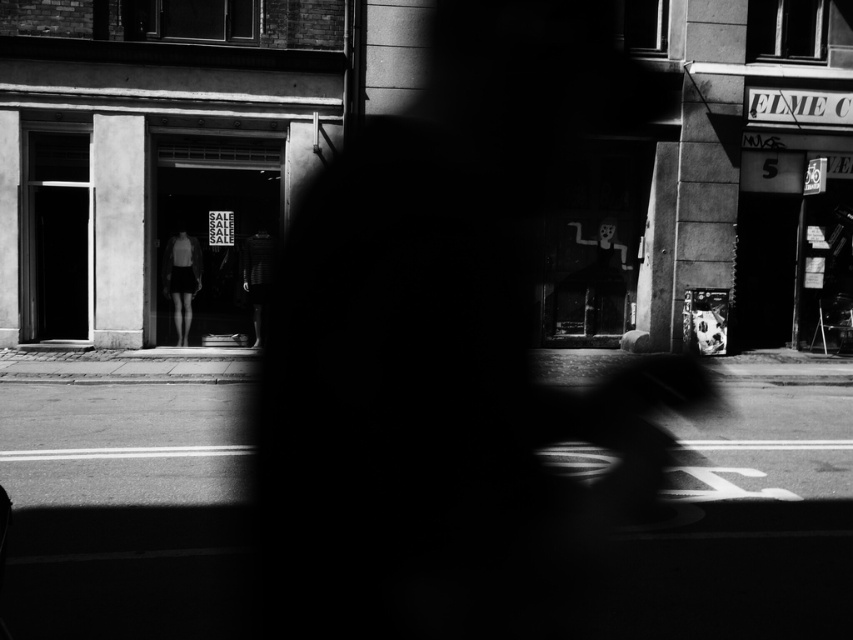
Question: Does smooth black mask at center have a larger size compared to smooth skin figure at center?

Choices:
 (A) no
 (B) yes

Answer: (B)

Question: Can you confirm if smooth black mask at center is positioned below dark textured shirt at center?

Choices:
 (A) yes
 (B) no

Answer: (B)

Question: Is smooth skin figure at center positioned at the back of dark textured shirt at center?

Choices:
 (A) no
 (B) yes

Answer: (B)

Question: Which object is closer to the camera taking this photo?

Choices:
 (A) smooth skin figure at center
 (B) dark textured shirt at center

Answer: (B)

Question: Estimate the real-world distances between objects in this image. Which object is farther from the dark textured shirt at center?

Choices:
 (A) smooth skin figure at center
 (B) smooth black mask at center

Answer: (B)

Question: Which point is farther from the camera taking this photo?

Choices:
 (A) click(254, 260)
 (B) click(172, 262)

Answer: (B)